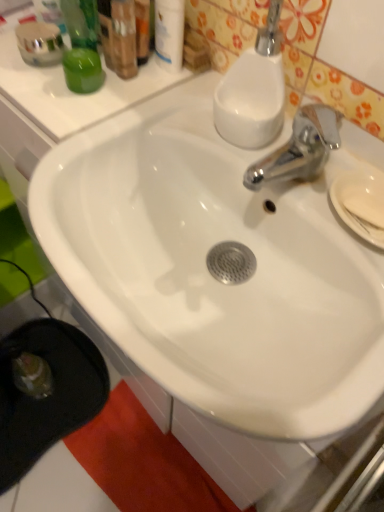
Identify the location of vacant space situated on the left part of white glossy lotion at upper center. (58, 84).